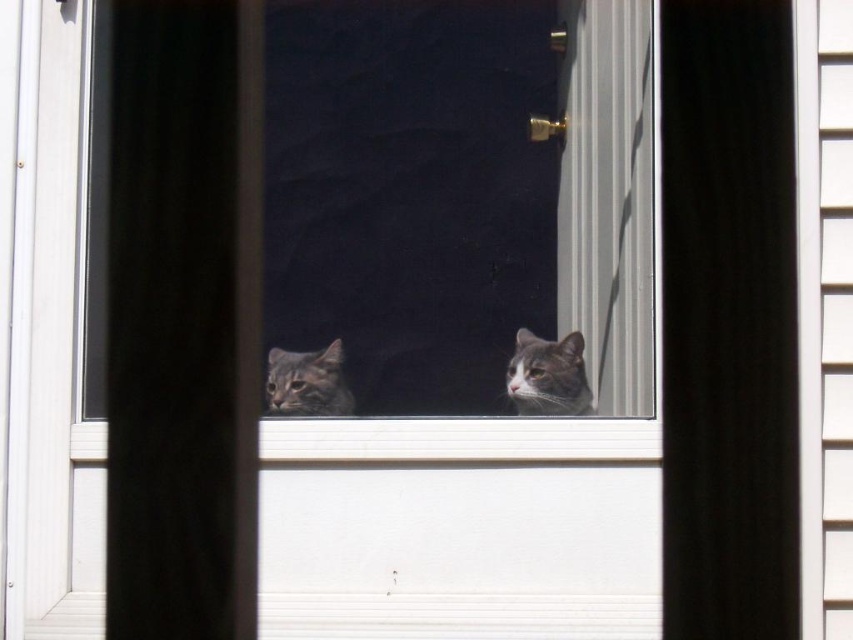
Who is taller, white plastic window sill at lower center or gray soft fur cat at center?

gray soft fur cat at center

Describe the element at coordinates (459, 440) in the screenshot. I see `white plastic window sill at lower center` at that location.

The height and width of the screenshot is (640, 853). I want to click on white plastic window sill at lower center, so click(459, 440).

Is point (556, 404) closer to viewer compared to point (281, 355)?

Yes, it is in front of point (281, 355).

Does point (532, 412) come behind point (285, 372)?

No, it is in front of (285, 372).

Does point (584, 372) lie behind point (292, 403)?

No, it is not.

Where is `gray soft fur cat at center`? gray soft fur cat at center is located at coordinates [548, 376].

Does white plastic window sill at lower center come in front of tabby fur cat at center?

Yes, it is.

Where is `white plastic window sill at lower center`? The image size is (853, 640). white plastic window sill at lower center is located at coordinates (459, 440).